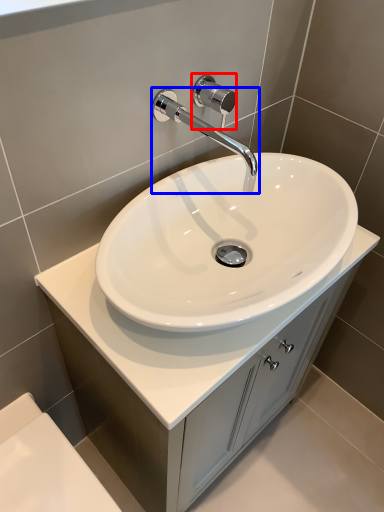
Question: Which object appears farthest to the camera in this image, shower (highlighted by a red box) or tap (highlighted by a blue box)?

Choices:
 (A) shower
 (B) tap

Answer: (A)